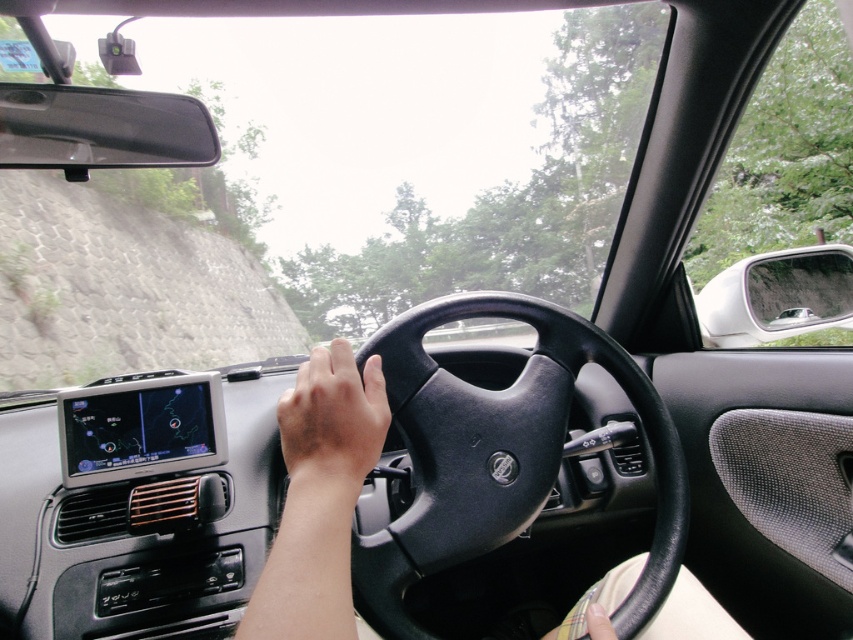
You are a driver sitting in the car seat. You want to reach a point that is 98.26 centimeters away from you. Can you reach the point located at coordinate point (424, 509)?

The distance of point (424, 509) from viewer is 98.26 centimeters, so yes, you can reach the point located at coordinate point (424, 509) if your arm can extend that far.

Consider the image. You are a passenger in the car and want to know if the gray stone wall at upper left is taller than the brown matte hand at center. Based on the scene, can you confirm this?

The gray stone wall at upper left is much taller than the brown matte hand at center according to the description.